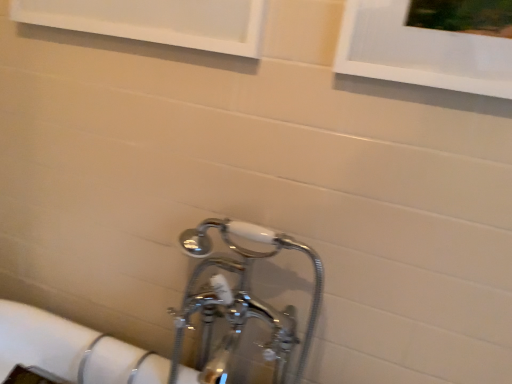
In order to face chrome/metallic faucet at lower center, should I rotate leftwards or rightwards?

Rotate your view left by about 3.725°.

This screenshot has width=512, height=384. Describe the element at coordinates (241, 300) in the screenshot. I see `chrome/metallic faucet at lower center` at that location.

Find the location of a particular element. The image size is (512, 384). chrome/metallic faucet at lower center is located at coordinates (241, 300).

Identify the location of chrome/metallic faucet at lower center. coord(241,300).